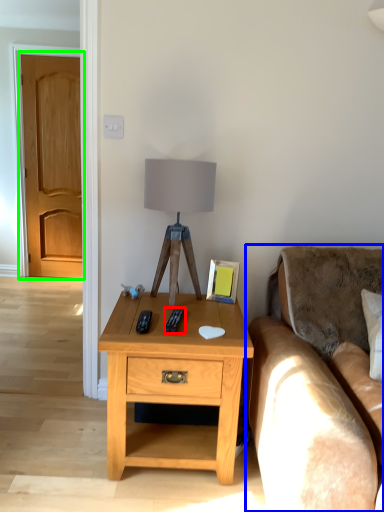
Question: Which object is positioned closest to remote (highlighted by a red box)? Select from studio couch (highlighted by a blue box) and door (highlighted by a green box).

Choices:
 (A) studio couch
 (B) door

Answer: (A)